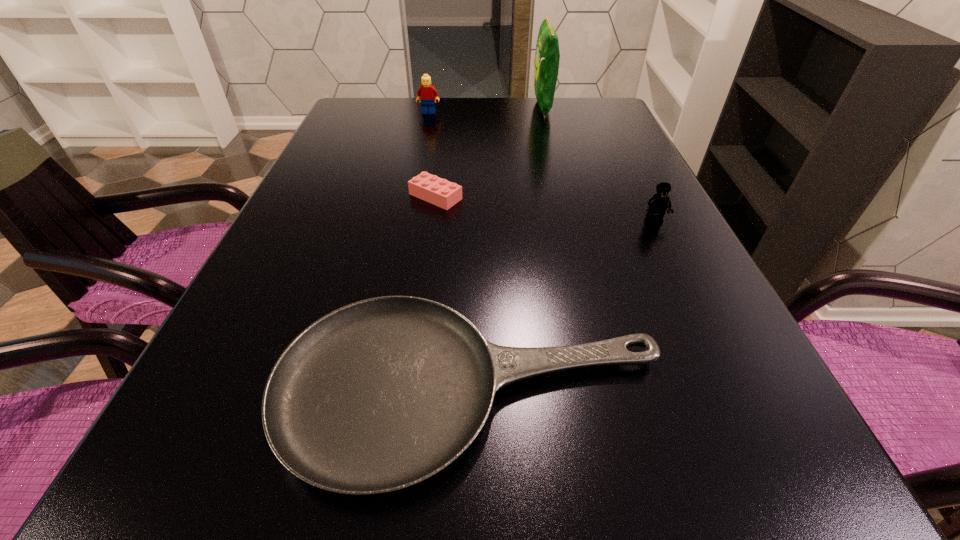
You are a GUI agent. You are given a task and a screenshot of the screen. Output one action in this format:
    pyautogui.click(x=<x>, y=<y>)
    Task: Click on the tallest object
    This screenshot has height=540, width=960.
    Given the screenshot: What is the action you would take?
    pyautogui.click(x=547, y=56)

Identify the location of the tallest Lego. This screenshot has height=540, width=960. (426, 93).

Where is `the farthest Lego`? The image size is (960, 540). the farthest Lego is located at coordinates (426, 93).

Identify the location of the rightmost Lego. This screenshot has width=960, height=540. (657, 205).

This screenshot has height=540, width=960. I want to click on the second shortest Lego, so click(x=657, y=205).

This screenshot has height=540, width=960. In order to click on the second farthest Lego in this screenshot , I will do `click(430, 188)`.

Locate an element on the screen. The height and width of the screenshot is (540, 960). the third nearest object is located at coordinates [x=430, y=188].

I want to click on the nearest object, so click(378, 395).

This screenshot has height=540, width=960. I want to click on frying pan, so click(x=378, y=395).

In order to click on free location located 0.300m on the front-facing side of the tallest object in this screenshot , I will do `click(435, 107)`.